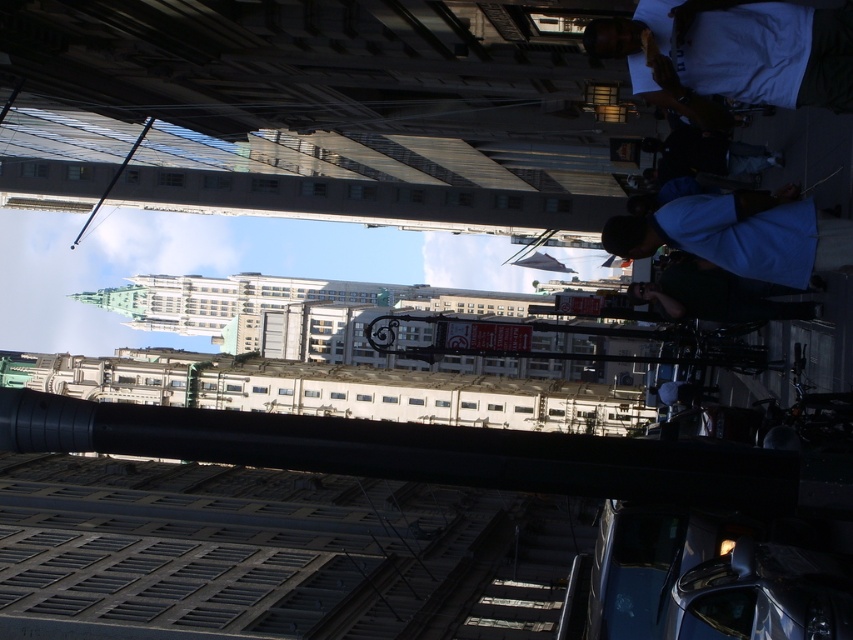
You are a photographer standing at the base of the lamppost in the scene. You want to capture both the metallic gray train track at lower center and the white cotton shirt at upper right in the same frame. Which object will appear larger in your photo?

The metallic gray train track at lower center will appear larger in the photo because it is bigger than the white cotton shirt at upper right.

You are a photographer trying to capture the entire scene in one shot. You notice the metallic gray train track at lower center and the white cotton shirt at upper right. Which object will appear wider in your photo?

The metallic gray train track at lower center will appear wider in the photo because its width is larger than the white cotton shirt at upper right.